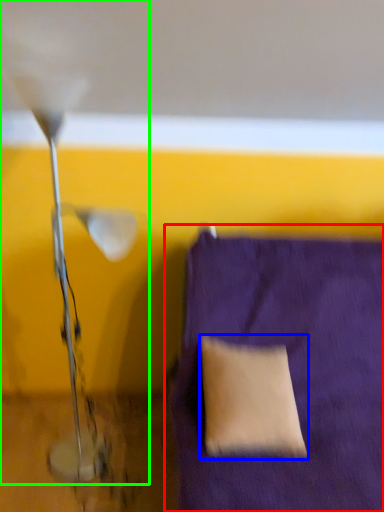
Question: Which is farther away from furniture (highlighted by a red box)? pillow (highlighted by a blue box) or lamp (highlighted by a green box)?

Choices:
 (A) pillow
 (B) lamp

Answer: (B)